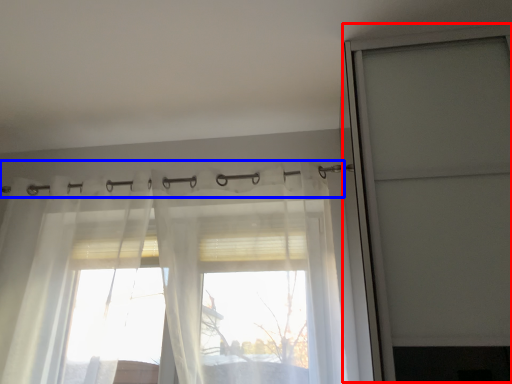
Question: Which of the following is the closest to the observer, screen door (highlighted by a red box) or clothesline (highlighted by a blue box)?

Choices:
 (A) screen door
 (B) clothesline

Answer: (A)